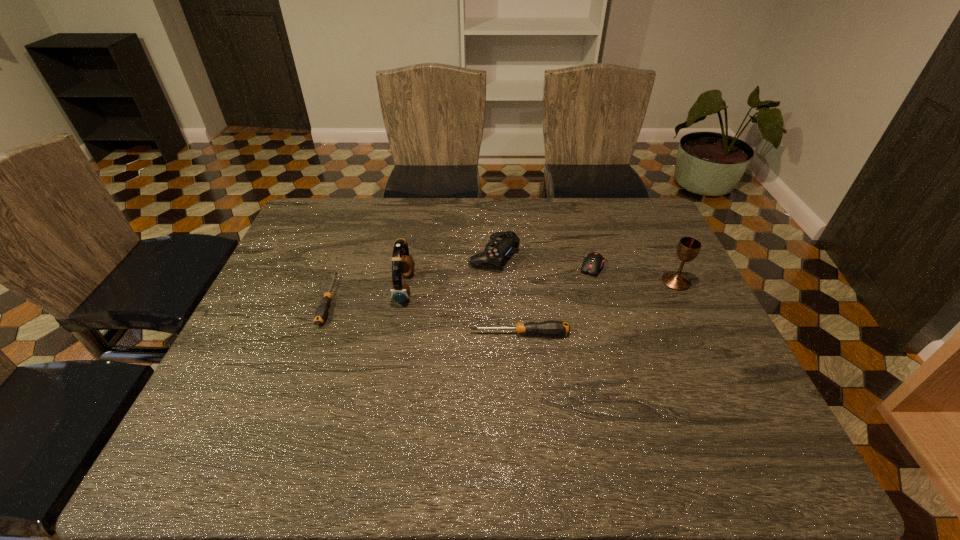
All screwdrivers are currently evenly spaced. To continue this pattern, where would you add another screwdriver on the right? Please point out a vacant spot. Please provide its 2D coordinates. Your answer should be formatted as a tuple, i.e. [(x, y)], where the tuple contains the x and y coordinates of a point satisfying the conditions above.

[(742, 372)]